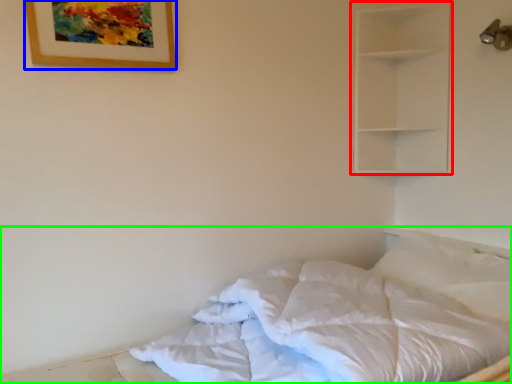
Question: Which object is the farthest from shelf (highlighted by a red box)? Choose among these: picture frame (highlighted by a blue box) or bed (highlighted by a green box).

Choices:
 (A) picture frame
 (B) bed

Answer: (B)